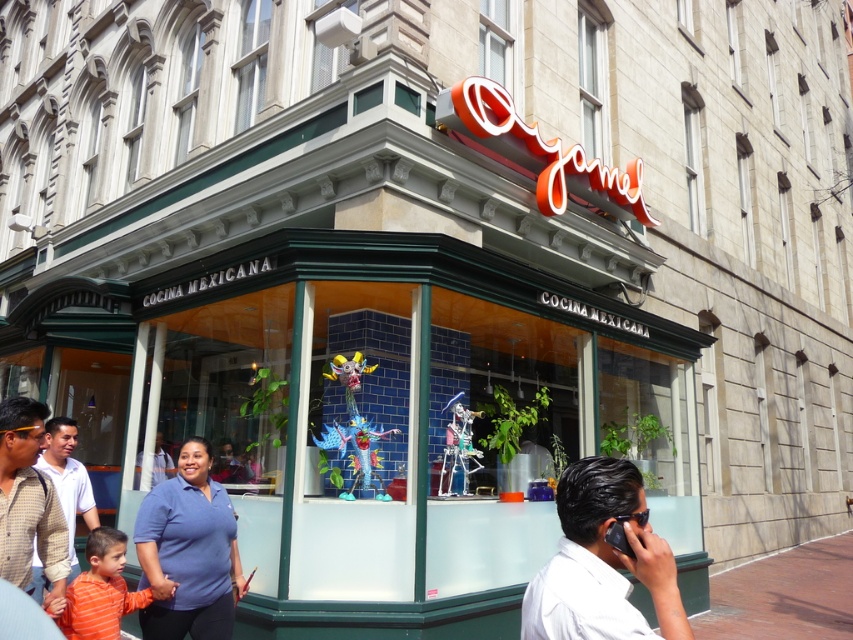
Does point (172, 513) come in front of point (782, 620)?

Yes, point (172, 513) is in front of point (782, 620).

Does blue fabric shirt at lower left lie in front of brick pavement at lower right?

Yes, blue fabric shirt at lower left is in front of brick pavement at lower right.

Between point (161, 520) and point (733, 616), which one is positioned in front?

Point (161, 520) is in front.

Identify the location of blue fabric shirt at lower left. (189, 552).

Can you confirm if brick pavement at lower right is wider than checkered fabric shirt at lower left?

Yes.

Which is behind, point (741, 566) or point (9, 449)?

Positioned behind is point (741, 566).

This screenshot has height=640, width=853. What do you see at coordinates (784, 595) in the screenshot? I see `brick pavement at lower right` at bounding box center [784, 595].

You are a GUI agent. You are given a task and a screenshot of the screen. Output one action in this format:
    pyautogui.click(x=<x>, y=<y>)
    Task: Click on the brick pavement at lower right
    This screenshot has height=640, width=853.
    Given the screenshot: What is the action you would take?
    pyautogui.click(x=784, y=595)

Can you confirm if brick pavement at lower right is taller than white shirt at center?

Indeed, brick pavement at lower right has a greater height compared to white shirt at center.

Is brick pavement at lower right to the right of white shirt at center from the viewer's perspective?

Yes, brick pavement at lower right is to the right of white shirt at center.

Image resolution: width=853 pixels, height=640 pixels. What do you see at coordinates (784, 595) in the screenshot? I see `brick pavement at lower right` at bounding box center [784, 595].

The height and width of the screenshot is (640, 853). Find the location of `brick pavement at lower right`. brick pavement at lower right is located at coordinates (784, 595).